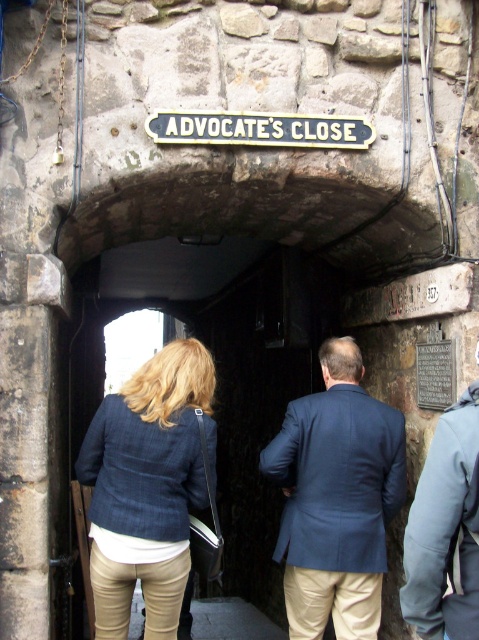
You are a traveler standing in front of the stone archway with the black sign. You see a blue fabric jacket at center and a blue fabric coat at center. Which one is larger?

The blue fabric jacket at center is bigger than the blue fabric coat at center.

You are standing in front of the stone archway with the black sign that says ADVOCATE CLOSE. You see a blue fabric jacket at center. Where exactly is the blue fabric jacket located in relation to the archway?

The blue fabric jacket at center is located at point (337, 499) relative to the archway.